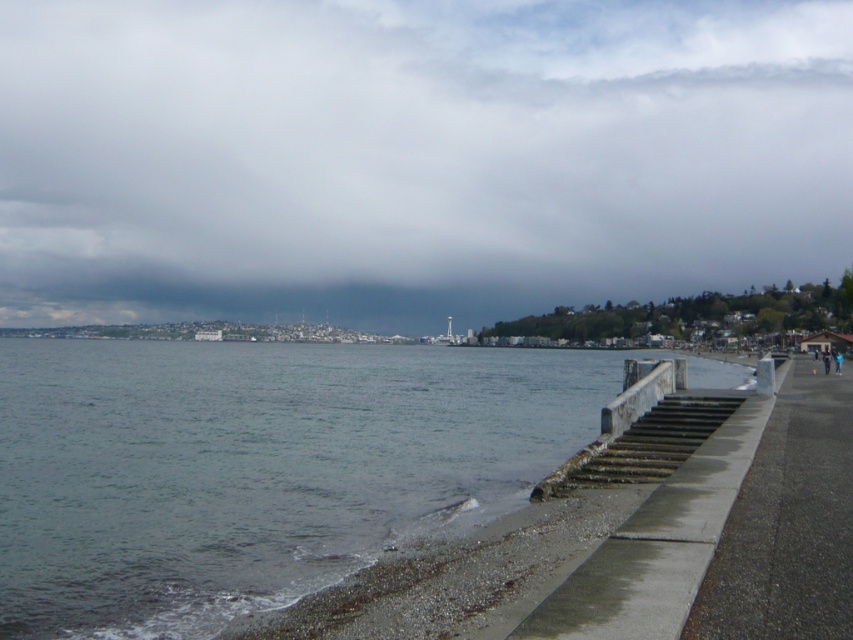
You are a weather observer standing on the concrete walkway. You notice the dark gray cloud at upper center and the clear water at lower left. Which of these two features is wider in the image?

The dark gray cloud at upper center might be wider than clear water at lower left.

You are standing on the concrete walkway near the low wall and steps. You see a point marked as point (415, 156). What does this point represent?

The point (415, 156) represents the location of the dark gray cloud at upper center.

Looking at this image, you are standing on the beach and want to walk to the gray concrete pavement at lower right. The coordinates of your current position are point [788,524]. Is the gray concrete pavement at lower right directly in front of you?

The gray concrete pavement at lower right is located at point [788,524], which is your current position. Therefore, you are already standing on the gray concrete pavement at lower right.